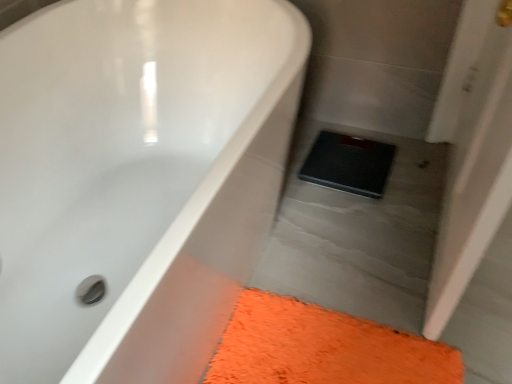
Question: In terms of height, does orange shaggy bath mat at lower right look taller or shorter compared to black rubber scale at center?

Choices:
 (A) tall
 (B) short

Answer: (B)

Question: Based on their sizes in the image, would you say orange shaggy bath mat at lower right is bigger or smaller than black rubber scale at center?

Choices:
 (A) big
 (B) small

Answer: (B)

Question: Based on their relative distances, which object is nearer to the black rubber scale at center?

Choices:
 (A) white glossy bathtub at upper left
 (B) orange shaggy bath mat at lower right

Answer: (B)

Question: Considering the real-world distances, which object is closest to the orange shaggy bath mat at lower right?

Choices:
 (A) black rubber scale at center
 (B) white glossy bathtub at upper left

Answer: (B)